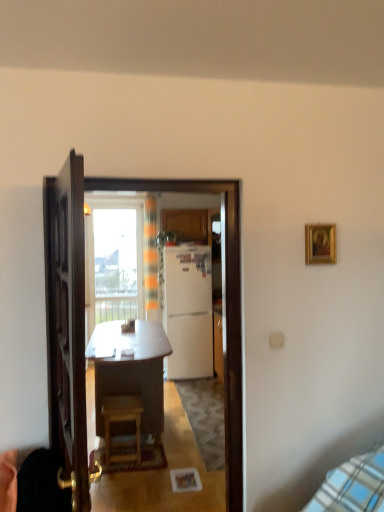
Question: Is gold-framed picture at upper right in front of white glossy refrigerator at center?

Choices:
 (A) yes
 (B) no

Answer: (B)

Question: From a real-world perspective, is gold-framed picture at upper right physically above white glossy refrigerator at center?

Choices:
 (A) no
 (B) yes

Answer: (B)

Question: Could you tell me if gold-framed picture at upper right is turned towards white glossy refrigerator at center?

Choices:
 (A) yes
 (B) no

Answer: (B)

Question: Is gold-framed picture at upper right wider than white glossy refrigerator at center?

Choices:
 (A) yes
 (B) no

Answer: (B)

Question: From the image's perspective, is gold-framed picture at upper right above white glossy refrigerator at center?

Choices:
 (A) yes
 (B) no

Answer: (A)

Question: Looking at their shapes, would you say wooden door at center is wider or thinner than white glossy refrigerator at center?

Choices:
 (A) thin
 (B) wide

Answer: (A)

Question: Is wooden door at center to the left or to the right of white glossy refrigerator at center in the image?

Choices:
 (A) left
 (B) right

Answer: (A)

Question: Is point (56, 382) closer or farther from the camera than point (64, 224)?

Choices:
 (A) closer
 (B) farther

Answer: (B)

Question: Do you think wooden door at center is within white glossy refrigerator at center, or outside of it?

Choices:
 (A) outside
 (B) inside

Answer: (A)

Question: Based on their sizes in the image, would you say wooden stool at center is bigger or smaller than gold-framed picture at upper right?

Choices:
 (A) small
 (B) big

Answer: (B)

Question: From a real-world perspective, relative to gold-framed picture at upper right, is wooden stool at center vertically above or below?

Choices:
 (A) above
 (B) below

Answer: (B)

Question: In the image, is wooden stool at center positioned in front of or behind gold-framed picture at upper right?

Choices:
 (A) front
 (B) behind

Answer: (B)

Question: Is wooden stool at center inside or outside of gold-framed picture at upper right?

Choices:
 (A) outside
 (B) inside

Answer: (A)

Question: Is gold-framed picture at upper right inside the boundaries of transparent glass window at upper center, or outside?

Choices:
 (A) outside
 (B) inside

Answer: (A)

Question: From a real-world perspective, relative to transparent glass window at upper center, is gold-framed picture at upper right vertically above or below?

Choices:
 (A) above
 (B) below

Answer: (A)